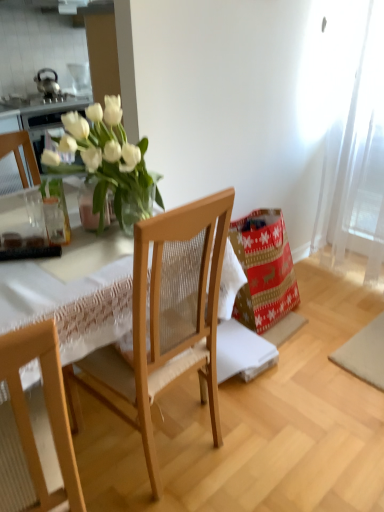
At what (x,y) coordinates should I click in order to perform the action: click on unoccupied area in front of clear glass vase at center. Please return your answer as a coordinate pair (x, y). The height and width of the screenshot is (512, 384). Looking at the image, I should click on (90, 244).